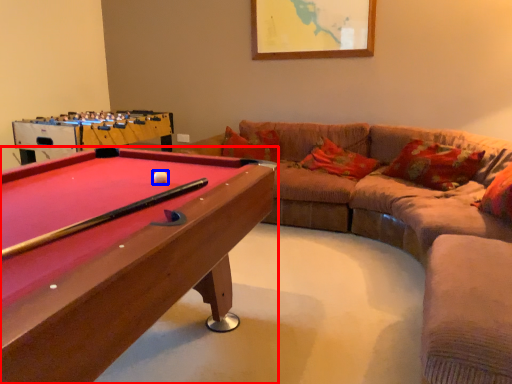
Question: Which of the following is the farthest to the observer, billiard table (highlighted by a red box) or ball (highlighted by a blue box)?

Choices:
 (A) billiard table
 (B) ball

Answer: (B)